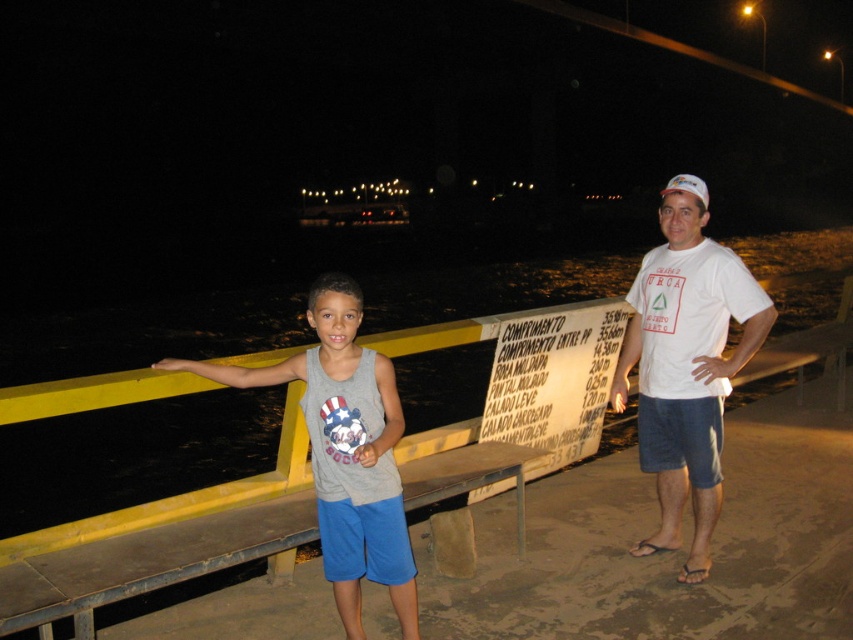
Between white cotton t-shirt at center and white paper sign at center, which one has more height?

white cotton t-shirt at center is taller.

Does white cotton t-shirt at center have a lesser width compared to white paper sign at center?

Yes, white cotton t-shirt at center is thinner than white paper sign at center.

Image resolution: width=853 pixels, height=640 pixels. What are the coordinates of `white cotton t-shirt at center` in the screenshot? It's located at (686, 364).

Does black water at lower left appear over gray cotton tank top at center?

Correct, black water at lower left is located above gray cotton tank top at center.

Does point (471, 403) lie behind point (395, 580)?

Yes, it is.

Locate an element on the screen. Image resolution: width=853 pixels, height=640 pixels. black water at lower left is located at coordinates (131, 454).

Describe the element at coordinates (345, 451) in the screenshot. The width and height of the screenshot is (853, 640). I see `gray cotton tank top at center` at that location.

Who is taller, gray cotton tank top at center or white paper sign at center?

gray cotton tank top at center is taller.

Who is more distant from viewer, (346, 323) or (570, 364)?

The point (570, 364) is behind.

Identify the location of gray cotton tank top at center. (345, 451).